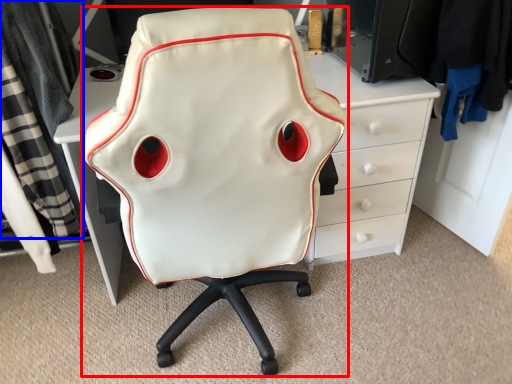
Question: Which point is further to the camera, chair (highlighted by a red box) or clothing (highlighted by a blue box)?

Choices:
 (A) chair
 (B) clothing

Answer: (B)